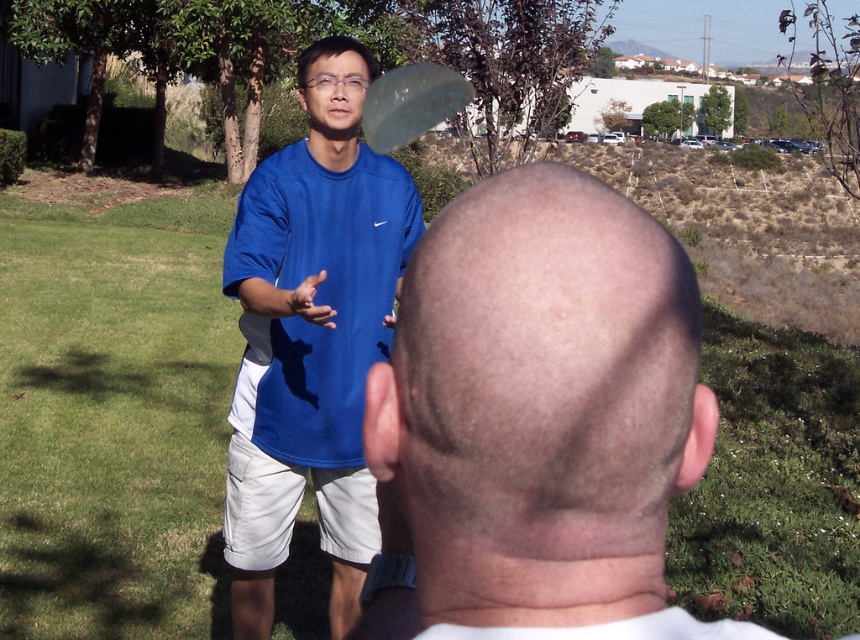
The height and width of the screenshot is (640, 860). Describe the element at coordinates (538, 420) in the screenshot. I see `blue matte shirt at upper left` at that location.

This screenshot has height=640, width=860. What are the coordinates of `blue matte shirt at upper left` in the screenshot? It's located at tap(538, 420).

Who is more forward, [344,321] or [387,88]?

Point [344,321] is in front.

At what (x,y) coordinates should I click in order to perform the action: click on blue matte shirt at center. Please return your answer as a coordinate pair (x, y). The width and height of the screenshot is (860, 640). Looking at the image, I should click on (311, 337).

Image resolution: width=860 pixels, height=640 pixels. Identify the location of blue matte shirt at upper left. (538, 420).

Looking at this image, is blue matte shirt at upper left positioned in front of transparent plastic frisbee at upper center?

Yes, blue matte shirt at upper left is in front of transparent plastic frisbee at upper center.

Which is in front, point (688, 636) or point (416, 68)?

Point (688, 636) is in front.

I want to click on blue matte shirt at upper left, so click(x=538, y=420).